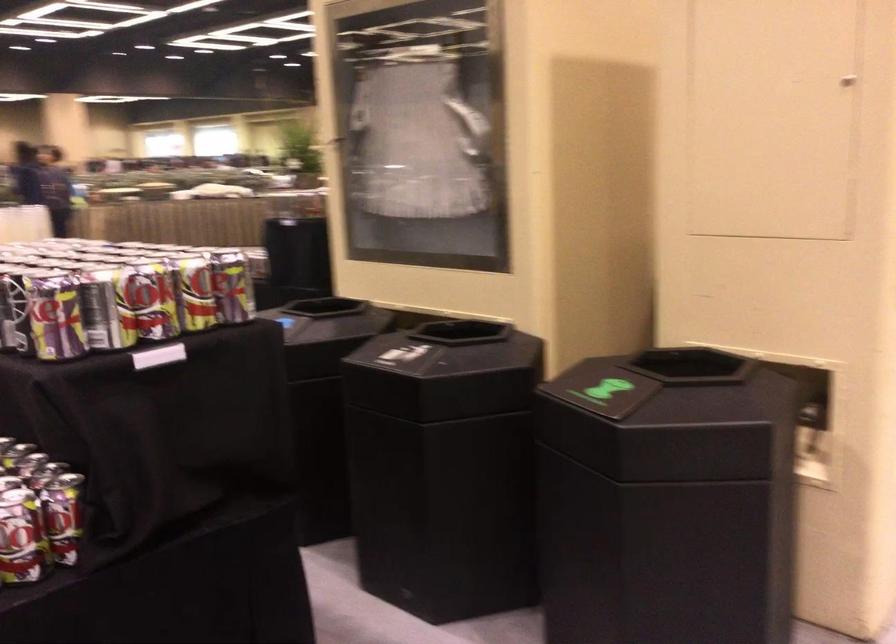
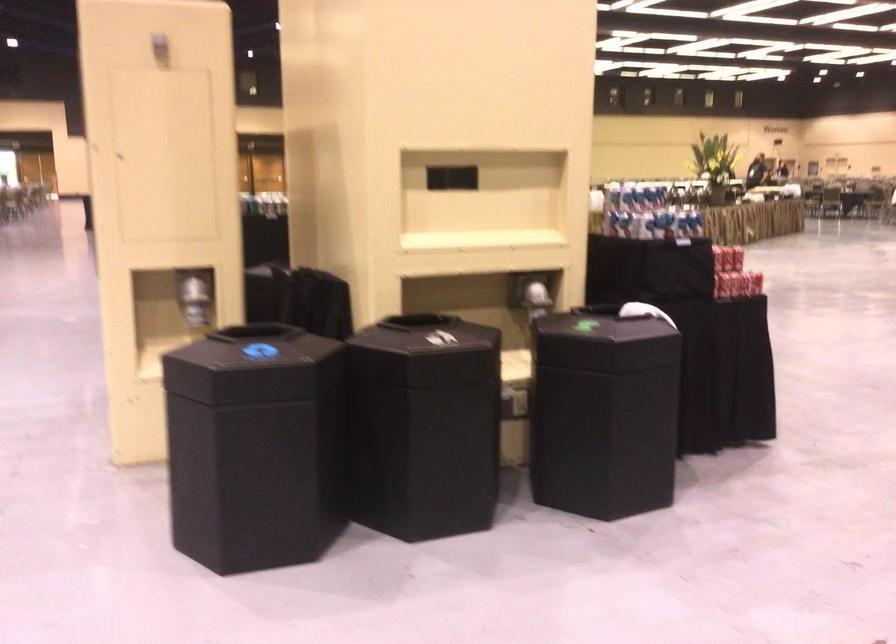
Question: I am providing you with two images of the same scene from different viewpoints. Please identify which objects are invisible in image2.

Choices:
 (A) black bin opening
 (B) red tipped pen
 (C) shiny dispenser lever
 (D) black bin lid

Answer: (A)